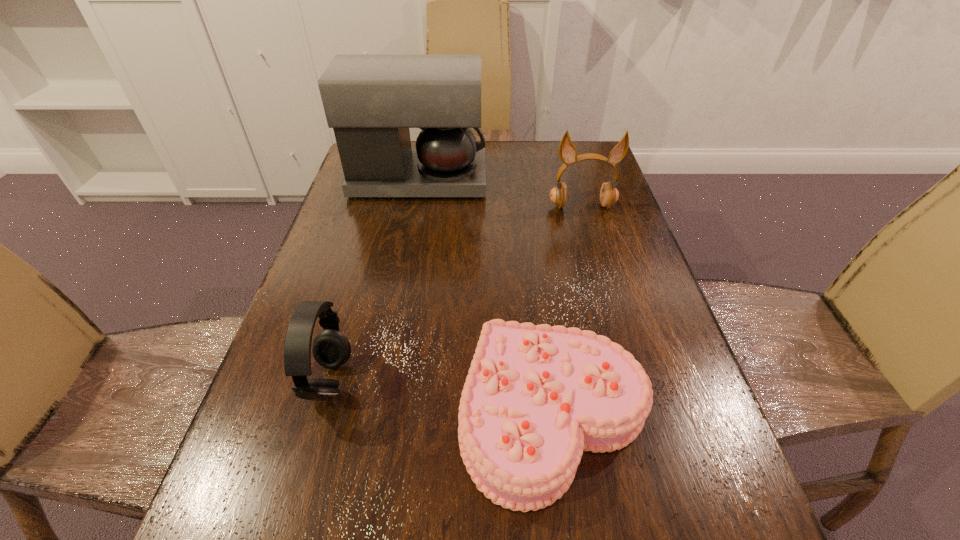
Image resolution: width=960 pixels, height=540 pixels. I want to click on object positioned at the far edge, so [370, 100].

This screenshot has height=540, width=960. What are the coordinates of `coffee maker positioned at the left edge` in the screenshot? It's located at (370, 100).

Find the location of a particular element. earphone positioned at the left edge is located at coordinates (331, 349).

Locate an element on the screen. Image resolution: width=960 pixels, height=540 pixels. earphone positioned at the right edge is located at coordinates (609, 194).

The image size is (960, 540). What are the coordinates of `cake that is at the right edge` in the screenshot? It's located at (535, 397).

Find the location of a particular element. The height and width of the screenshot is (540, 960). object located at the far left corner is located at coordinates (370, 100).

Identify the location of vacant space at the far edge of the desktop. (527, 141).

Where is `free location at the left edge of the desktop`? Image resolution: width=960 pixels, height=540 pixels. free location at the left edge of the desktop is located at coordinates (337, 254).

In the image, there is a desktop. Where is `vacant space at the right edge`? The image size is (960, 540). vacant space at the right edge is located at coordinates (615, 204).

This screenshot has width=960, height=540. Find the location of `free point between the nearer earphone and the second tallest object`. free point between the nearer earphone and the second tallest object is located at coordinates (456, 294).